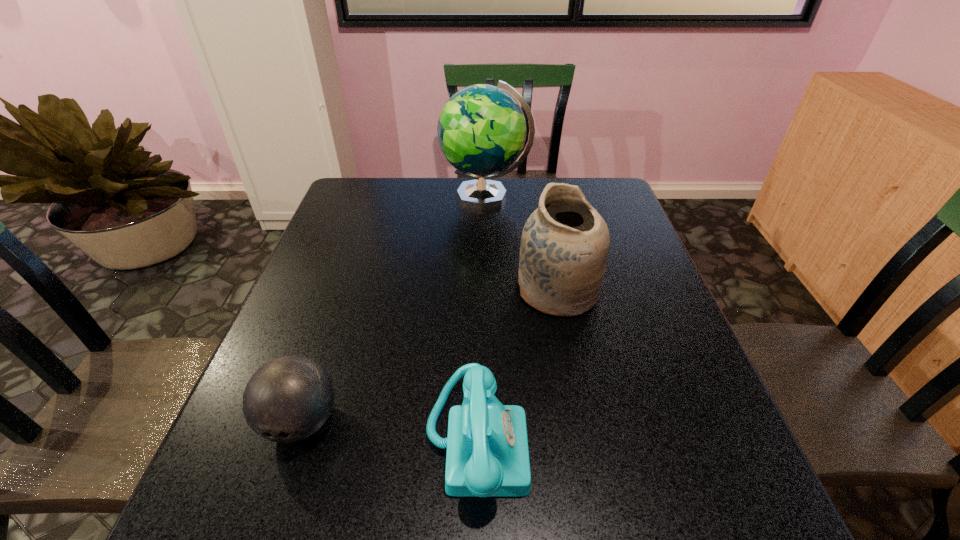
The image size is (960, 540). In order to click on free space that satisfies the following two spatial constraints: 1. on the front surface of the second farthest object; 2. on the left side of the tallest object in this screenshot , I will do `click(488, 291)`.

This screenshot has height=540, width=960. Find the location of `vacant space that satisfies the following two spatial constraints: 1. on the front surface of the farthest object; 2. on the grip area of the bowling ball`. vacant space that satisfies the following two spatial constraints: 1. on the front surface of the farthest object; 2. on the grip area of the bowling ball is located at coordinates (490, 421).

Find the location of a particular element. free space in the image that satisfies the following two spatial constraints: 1. on the front surface of the globe; 2. on the grip area of the bowling ball is located at coordinates (490, 421).

The width and height of the screenshot is (960, 540). In order to click on free location that satisfies the following two spatial constraints: 1. on the front surface of the globe; 2. on the right side of the pottery in this screenshot , I will do `click(488, 291)`.

The width and height of the screenshot is (960, 540). I want to click on free space that satisfies the following two spatial constraints: 1. on the back side of the pottery; 2. on the front surface of the farthest object, so click(540, 197).

The image size is (960, 540). In order to click on free space that satisfies the following two spatial constraints: 1. on the front surface of the tallest object; 2. on the grip area of the leftmost object in this screenshot , I will do `click(490, 421)`.